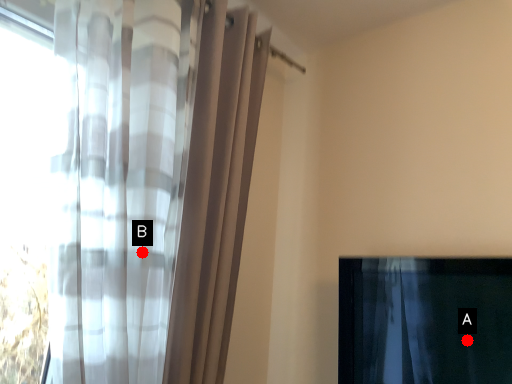
Question: Two points are circled on the image, labeled by A and B beside each circle. Which point is closer to the camera?

Choices:
 (A) A is closer
 (B) B is closer

Answer: (B)